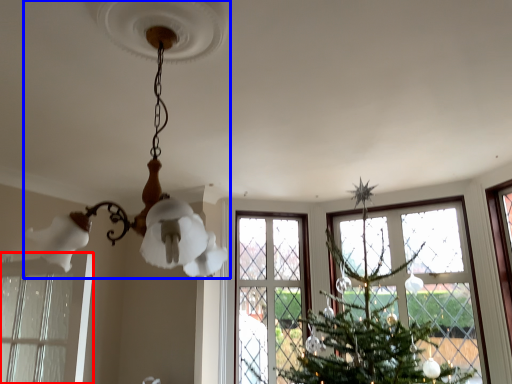
Question: Which object is further to the camera taking this photo, window (highlighted by a red box) or lamp (highlighted by a blue box)?

Choices:
 (A) window
 (B) lamp

Answer: (A)